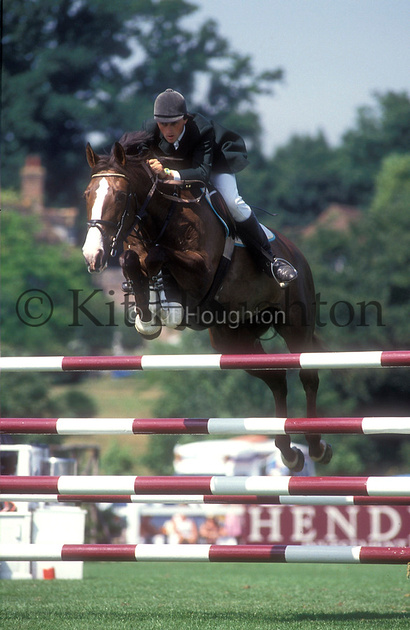
You are a GUI agent. You are given a task and a screenshot of the screen. Output one action in this format:
    pyautogui.click(x=<x>, y=<y>)
    Task: Click on the chimney
    
    Given the screenshot: What is the action you would take?
    pyautogui.click(x=27, y=181)